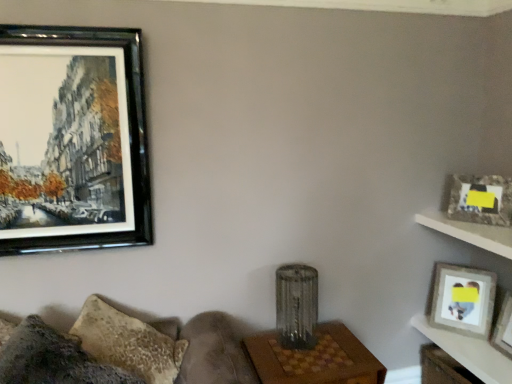
Question: Based on their positions, is wooden table at center, the 1th table viewed from the left, located to the left or right of wooden table at lower right, positioned as the 2th table in left-to-right order?

Choices:
 (A) left
 (B) right

Answer: (A)

Question: In terms of height, does wooden table at center, the 1th table viewed from the left, look taller or shorter compared to wooden table at lower right, which is the 1th table in right-to-left order?

Choices:
 (A) short
 (B) tall

Answer: (B)

Question: Estimate the real-world distances between objects in this image. Which object is closer to the wooden table at center, which is the 2th table from right to left?

Choices:
 (A) metallic textured lamp at center
 (B) white wood shelf at upper right
 (C) matte gray picture frame at upper right, which is counted as the 2th picture frame, starting from the top
 (D) textured gray couch at lower left
 (E) black glossy picture frame at upper left, which is the first picture frame in left-to-right order

Answer: (A)

Question: Which object is the farthest from the wooden photo frame at upper right, the second picture frame in the left-to-right sequence?

Choices:
 (A) matte gray picture frame at upper right, which is counted as the 2th picture frame, starting from the top
 (B) metallic textured lamp at center
 (C) white wood shelf at upper right
 (D) black glossy picture frame at upper left, which is the 3th picture frame in bottom-to-top order
 (E) wooden table at lower right, which is the 1th table in right-to-left order

Answer: (D)